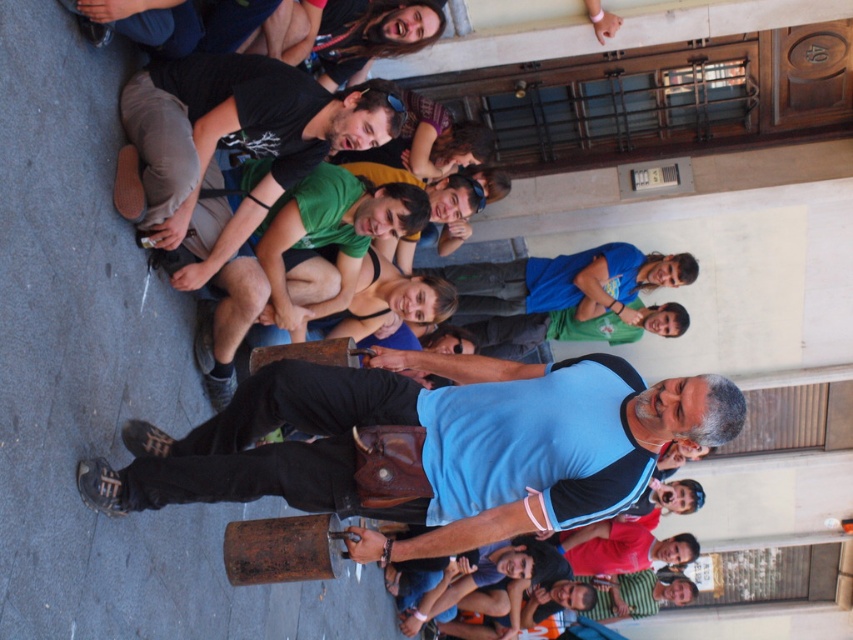
Question: Can you confirm if blue fabric shirt at center is wider than green matte shirt at center?

Choices:
 (A) no
 (B) yes

Answer: (B)

Question: Which object is farther from the camera taking this photo?

Choices:
 (A) blue fabric shirt at center
 (B) green matte shirt at center

Answer: (B)

Question: Is blue fabric shirt at center smaller than green matte shirt at center?

Choices:
 (A) no
 (B) yes

Answer: (A)

Question: Which object is closer to the camera taking this photo?

Choices:
 (A) green matte shirt at center
 (B) blue fabric shirt at center

Answer: (B)

Question: Is blue fabric shirt at center positioned behind green matte shirt at center?

Choices:
 (A) yes
 (B) no

Answer: (B)